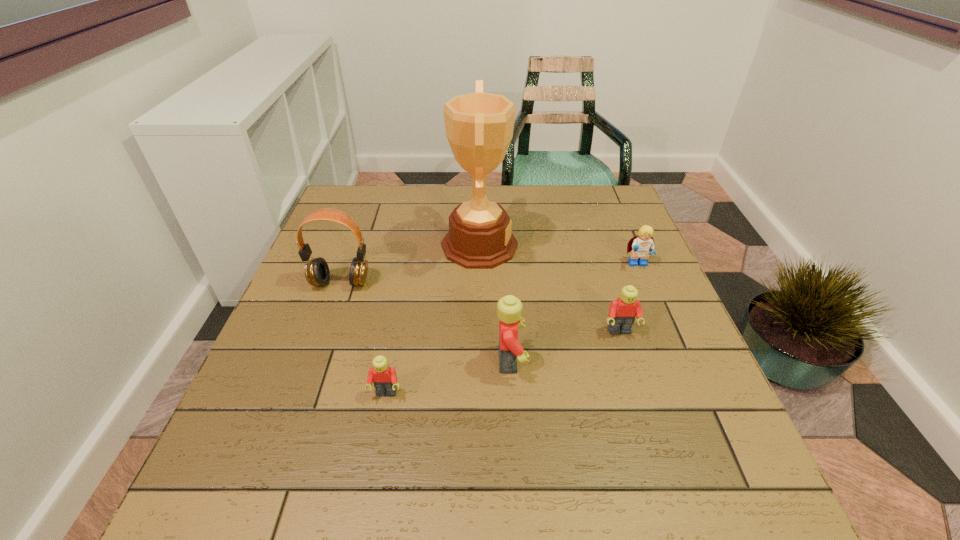
Identify the location of free space that satisfies the following two spatial constraints: 1. on the front-facing side of the tallest object; 2. on the face of the nearest object. The width and height of the screenshot is (960, 540). (479, 394).